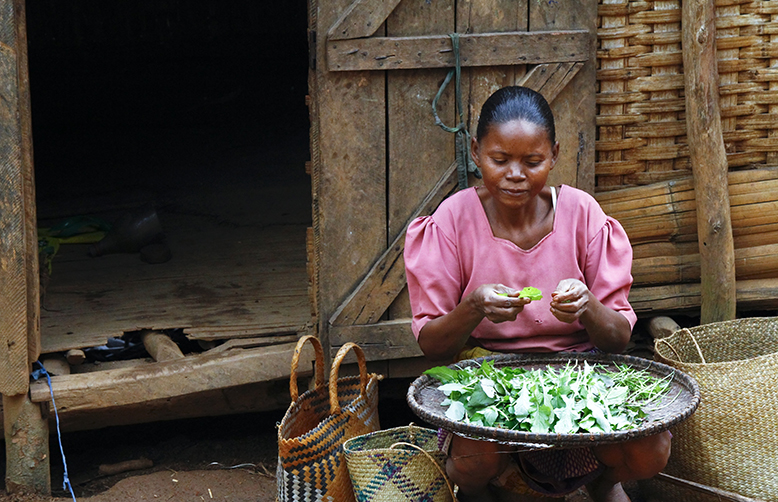
Find the location of a particular element. brown floor is located at coordinates (240, 282).